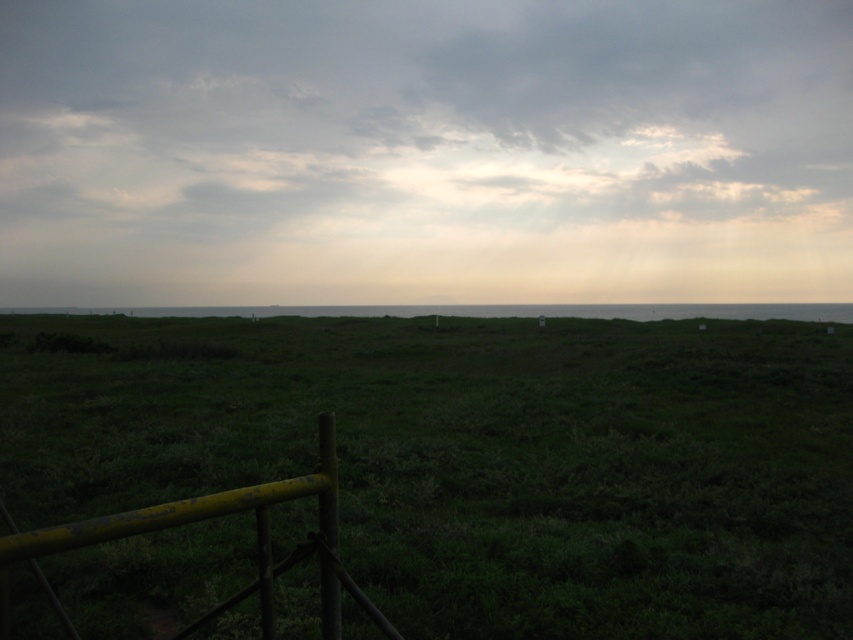
Where is `yellow painted wood fence at lower left`? The image size is (853, 640). yellow painted wood fence at lower left is located at coordinates (207, 518).

Is point (173, 520) farther from viewer compared to point (741, 314)?

No, (173, 520) is closer to viewer.

Does point (288, 490) come closer to viewer compared to point (6, 310)?

Yes.

I want to click on yellow painted wood fence at lower left, so click(x=207, y=518).

Which is behind, point (692, 474) or point (70, 547)?

Point (692, 474)

From the picture: Which of these two, green grassy at center or yellow painted wood fence at lower left, stands taller?

With more height is green grassy at center.

Is point (242, 541) farther from viewer compared to point (73, 632)?

Yes.

You are a GUI agent. You are given a task and a screenshot of the screen. Output one action in this format:
    pyautogui.click(x=<x>, y=<y>)
    Task: Click on the green grassy at center
    The image size is (853, 640).
    Given the screenshot: What is the action you would take?
    pyautogui.click(x=476, y=458)

Is cloudy sky at upper center above green grassy at center?

Indeed, cloudy sky at upper center is positioned over green grassy at center.

Can you confirm if cloudy sky at upper center is taller than green grassy at center?

Yes, cloudy sky at upper center is taller than green grassy at center.

Who is more forward, (718,252) or (265,326)?

Positioned in front is point (265,326).

The image size is (853, 640). In order to click on cloudy sky at upper center in this screenshot , I will do `click(424, 150)`.